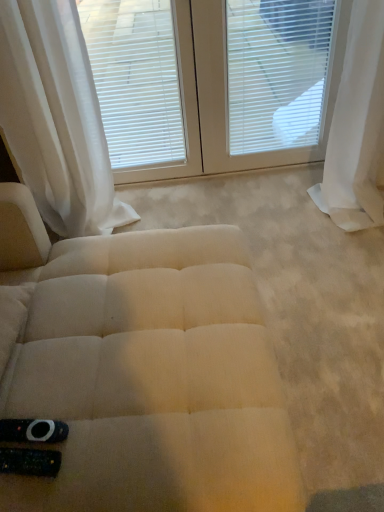
Question: Is white sheer curtain at upper left, positioned as the second curtain in right-to-left order, positioned behind white sheer curtain at right, the second curtain positioned from the left?

Choices:
 (A) no
 (B) yes

Answer: (A)

Question: Can you confirm if white sheer curtain at upper left, placed as the 1th curtain when sorted from left to right, is smaller than white sheer curtain at right, the first curtain viewed from the right?

Choices:
 (A) yes
 (B) no

Answer: (B)

Question: Is white sheer curtain at upper left, placed as the 1th curtain when sorted from left to right, closer to camera compared to white sheer curtain at right, the second curtain positioned from the left?

Choices:
 (A) no
 (B) yes

Answer: (B)

Question: From the image's perspective, is white sheer curtain at upper left, positioned as the second curtain in right-to-left order, over white sheer curtain at right, the second curtain positioned from the left?

Choices:
 (A) no
 (B) yes

Answer: (A)

Question: Does white sheer curtain at upper left, positioned as the second curtain in right-to-left order, appear on the left side of white sheer curtain at right, the second curtain positioned from the left?

Choices:
 (A) yes
 (B) no

Answer: (A)

Question: Is white matte window blind at upper center in front of or behind white textured blinds at upper center in the image?

Choices:
 (A) behind
 (B) front

Answer: (B)

Question: From a real-world perspective, relative to white textured blinds at upper center, is white matte window blind at upper center vertically above or below?

Choices:
 (A) below
 (B) above

Answer: (B)

Question: Is white matte window blind at upper center inside or outside of white textured blinds at upper center?

Choices:
 (A) inside
 (B) outside

Answer: (A)

Question: Considering the positions of white matte window blind at upper center and white textured blinds at upper center in the image, is white matte window blind at upper center wider or thinner than white textured blinds at upper center?

Choices:
 (A) wide
 (B) thin

Answer: (A)

Question: Considering the relative positions of beige fabric ottoman at center and white textured blinds at upper center in the image provided, is beige fabric ottoman at center to the left or to the right of white textured blinds at upper center?

Choices:
 (A) right
 (B) left

Answer: (A)

Question: From a real-world perspective, is beige fabric ottoman at center physically located above or below white textured blinds at upper center?

Choices:
 (A) below
 (B) above

Answer: (A)

Question: From their relative heights in the image, would you say beige fabric ottoman at center is taller or shorter than white textured blinds at upper center?

Choices:
 (A) short
 (B) tall

Answer: (A)

Question: From the image's perspective, is beige fabric ottoman at center located above or below white textured blinds at upper center?

Choices:
 (A) above
 (B) below

Answer: (B)

Question: From the image's perspective, relative to white sheer curtain at upper left, placed as the 1th curtain when sorted from left to right, is white textured blinds at upper center above or below?

Choices:
 (A) below
 (B) above

Answer: (B)

Question: From a real-world perspective, relative to white sheer curtain at upper left, placed as the 1th curtain when sorted from left to right, is white textured blinds at upper center vertically above or below?

Choices:
 (A) below
 (B) above

Answer: (A)